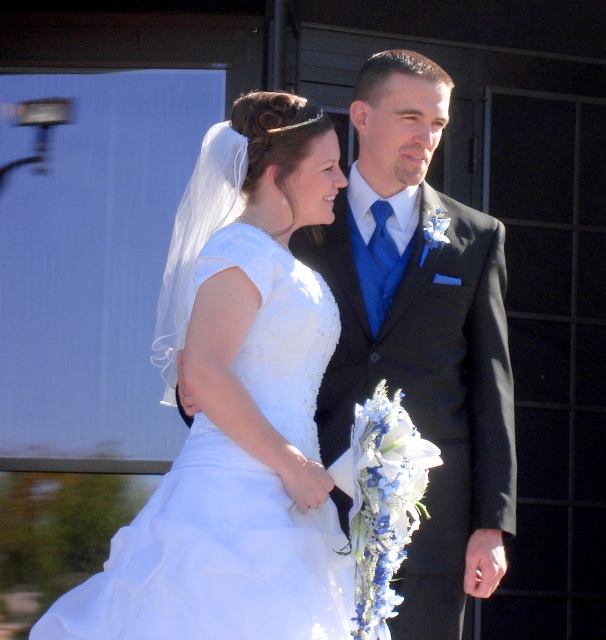
The width and height of the screenshot is (606, 640). What do you see at coordinates (421, 333) in the screenshot?
I see `shiny black suit at center` at bounding box center [421, 333].

Identify the location of shiny black suit at center. The width and height of the screenshot is (606, 640). (421, 333).